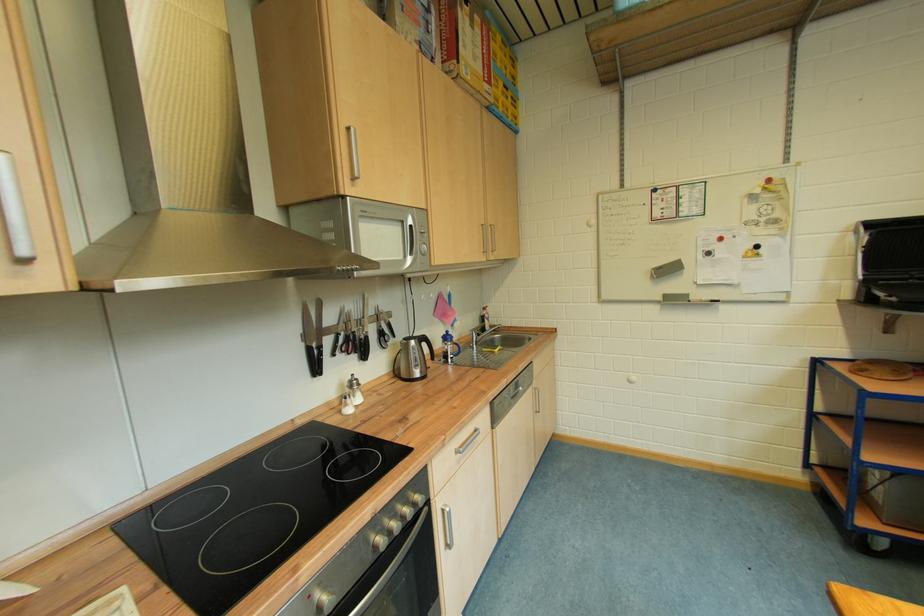
Find the location of a particular element. black handled scissors is located at coordinates (347, 334).